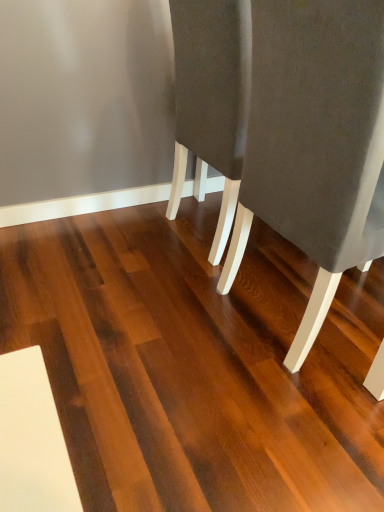
Question: Should I look upward or downward to see dark brown wood flooring at center?

Choices:
 (A) up
 (B) down

Answer: (B)

Question: Does suede-like gray chair at right have a larger size compared to dark brown wood flooring at center?

Choices:
 (A) no
 (B) yes

Answer: (B)

Question: Does suede-like gray chair at right have a greater height compared to dark brown wood flooring at center?

Choices:
 (A) yes
 (B) no

Answer: (A)

Question: From a real-world perspective, is suede-like gray chair at right under dark brown wood flooring at center?

Choices:
 (A) no
 (B) yes

Answer: (A)

Question: Can you confirm if suede-like gray chair at right is smaller than dark brown wood flooring at center?

Choices:
 (A) yes
 (B) no

Answer: (B)

Question: Is suede-like gray chair at right far from dark brown wood flooring at center?

Choices:
 (A) yes
 (B) no

Answer: (B)

Question: Does suede-like gray chair at right come in front of dark brown wood flooring at center?

Choices:
 (A) yes
 (B) no

Answer: (B)

Question: Is suede-like gray chair at right completely or partially inside dark brown wood flooring at center?

Choices:
 (A) yes
 (B) no

Answer: (B)

Question: Does dark brown wood flooring at center have a greater width compared to suede-like gray chair at right?

Choices:
 (A) no
 (B) yes

Answer: (B)

Question: Is dark brown wood flooring at center outside of suede-like gray chair at right?

Choices:
 (A) no
 (B) yes

Answer: (B)

Question: Is dark brown wood flooring at center not close to suede-like gray chair at right?

Choices:
 (A) no
 (B) yes

Answer: (A)

Question: Can you confirm if dark brown wood flooring at center is bigger than suede-like gray chair at right?

Choices:
 (A) no
 (B) yes

Answer: (A)

Question: Does dark brown wood flooring at center have a smaller size compared to suede-like gray chair at right?

Choices:
 (A) no
 (B) yes

Answer: (B)

Question: From the image's perspective, is dark brown wood flooring at center located above or below suede-like gray chair at right?

Choices:
 (A) below
 (B) above

Answer: (A)